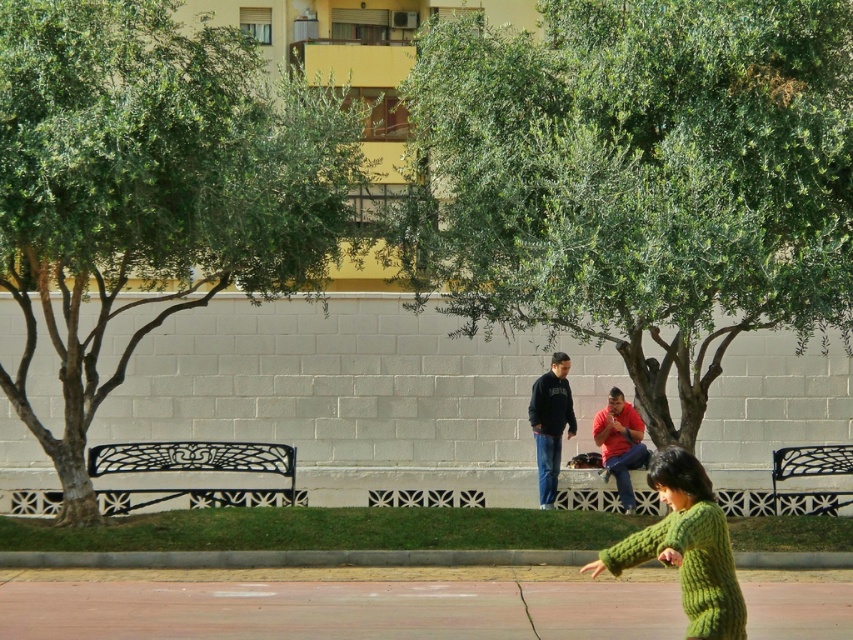
Question: Can you confirm if green leafy tree at left is bigger than red cotton shirt at center?

Choices:
 (A) no
 (B) yes

Answer: (B)

Question: Is green knitted sweater at lower right positioned before red cotton shirt at center?

Choices:
 (A) yes
 (B) no

Answer: (A)

Question: Among these points, which one is nearest to the camera?

Choices:
 (A) (688, 476)
 (B) (566, 388)

Answer: (A)

Question: Which point is farther from the camera taking this photo?

Choices:
 (A) pos(804,458)
 (B) pos(265,456)

Answer: (A)

Question: Does green knitted sweater at lower right have a lesser width compared to white wrought iron bench at lower left?

Choices:
 (A) yes
 (B) no

Answer: (A)

Question: Which is nearer to the red cotton shirt at center?

Choices:
 (A) green knitted sweater at lower right
 (B) dark blue sweatshirt at center

Answer: (B)